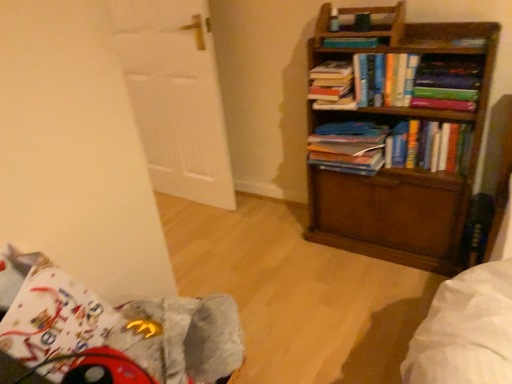
Question: Which direction should I rotate to look at blue matte book at center, which is the second book in bottom-to-top order, — up or down?

Choices:
 (A) down
 (B) up

Answer: (B)

Question: Can you confirm if hardcover books at center, the 1th book from the bottom, is smaller than hardcover book at upper center, marked as the 4th book in a bottom-to-top arrangement?

Choices:
 (A) yes
 (B) no

Answer: (B)

Question: Can you confirm if hardcover books at center, arranged as the 5th book when viewed from the top, is shorter than hardcover book at upper center, marked as the 4th book in a bottom-to-top arrangement?

Choices:
 (A) yes
 (B) no

Answer: (B)

Question: Does hardcover books at center, arranged as the 5th book when viewed from the top, turn towards hardcover book at upper center, which is the 2th book in top-to-bottom order?

Choices:
 (A) no
 (B) yes

Answer: (A)

Question: Is hardcover books at center, the 1th book from the bottom, positioned in front of hardcover book at upper center, marked as the 4th book in a bottom-to-top arrangement?

Choices:
 (A) yes
 (B) no

Answer: (A)

Question: From a real-world perspective, does hardcover books at center, arranged as the 5th book when viewed from the top, sit lower than hardcover book at upper center, which is the 2th book in top-to-bottom order?

Choices:
 (A) no
 (B) yes

Answer: (B)

Question: Does hardcover books at center, the 1th book from the bottom, have a larger size compared to hardcover book at upper center, which is the 2th book in top-to-bottom order?

Choices:
 (A) yes
 (B) no

Answer: (A)

Question: Considering the relative sizes of fuzzy fabric swivel chair at lower left and blue matte book at center, the 4th book viewed from the top, in the image provided, is fuzzy fabric swivel chair at lower left bigger than blue matte book at center, the 4th book viewed from the top,?

Choices:
 (A) yes
 (B) no

Answer: (A)

Question: Considering the relative sizes of fuzzy fabric swivel chair at lower left and blue matte book at center, the 4th book viewed from the top, in the image provided, is fuzzy fabric swivel chair at lower left smaller than blue matte book at center, the 4th book viewed from the top,?

Choices:
 (A) yes
 (B) no

Answer: (B)

Question: Would you consider fuzzy fabric swivel chair at lower left to be distant from blue matte book at center, the 4th book viewed from the top?

Choices:
 (A) yes
 (B) no

Answer: (B)

Question: From the image's perspective, is fuzzy fabric swivel chair at lower left below blue matte book at center, the 4th book viewed from the top?

Choices:
 (A) no
 (B) yes

Answer: (B)

Question: Considering the relative positions of fuzzy fabric swivel chair at lower left and blue matte book at center, the 4th book viewed from the top, in the image provided, is fuzzy fabric swivel chair at lower left to the right of blue matte book at center, the 4th book viewed from the top, from the viewer's perspective?

Choices:
 (A) yes
 (B) no

Answer: (B)

Question: Considering the relative sizes of fuzzy fabric swivel chair at lower left and blue matte book at center, the 4th book viewed from the top, in the image provided, is fuzzy fabric swivel chair at lower left wider than blue matte book at center, the 4th book viewed from the top,?

Choices:
 (A) yes
 (B) no

Answer: (A)

Question: Does white wooden door at left contain hardcover book at upper right?

Choices:
 (A) yes
 (B) no

Answer: (B)